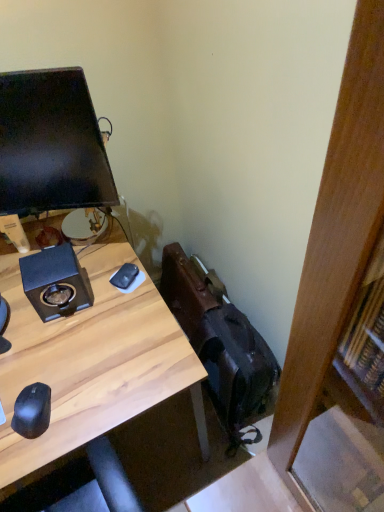
Question: From a real-world perspective, is black matte mouse at center, the 2th mouse positioned from the front, under black matte speaker at upper left?

Choices:
 (A) no
 (B) yes

Answer: (B)

Question: Is black matte mouse at center, the 1th mouse from the right, at the left side of black matte speaker at upper left?

Choices:
 (A) yes
 (B) no

Answer: (B)

Question: From a real-world perspective, is black matte mouse at center, which is counted as the second mouse, starting from the bottom, on top of black matte speaker at upper left?

Choices:
 (A) yes
 (B) no

Answer: (B)

Question: Is the position of black matte mouse at center, the first mouse when ordered from top to bottom, less distant than that of black matte speaker at upper left?

Choices:
 (A) yes
 (B) no

Answer: (B)

Question: Is black matte mouse at center, which is counted as the second mouse, starting from the bottom, smaller than black matte speaker at upper left?

Choices:
 (A) yes
 (B) no

Answer: (A)

Question: From a real-world perspective, is black matte mouse at lower left, which is the 1th mouse in front-to-back order, positioned above or below black matte speaker at upper left?

Choices:
 (A) below
 (B) above

Answer: (A)

Question: Is point (28, 391) positioned closer to the camera than point (79, 289)?

Choices:
 (A) closer
 (B) farther

Answer: (A)

Question: Looking at their shapes, would you say black matte mouse at lower left, arranged as the 2th mouse when viewed from the right, is wider or thinner than black matte speaker at upper left?

Choices:
 (A) wide
 (B) thin

Answer: (B)

Question: From the image's perspective, is black matte mouse at lower left, arranged as the 2th mouse when viewed from the right, located above or below black matte speaker at upper left?

Choices:
 (A) below
 (B) above

Answer: (A)

Question: Considering the positions of black matte speaker at upper left and black matte mouse at lower left, which is the 1th mouse in front-to-back order, in the image, is black matte speaker at upper left bigger or smaller than black matte mouse at lower left, which is the 1th mouse in front-to-back order,?

Choices:
 (A) small
 (B) big

Answer: (B)

Question: Looking at their shapes, would you say black matte speaker at upper left is wider or thinner than black matte mouse at lower left, the second mouse viewed from the top?

Choices:
 (A) wide
 (B) thin

Answer: (A)

Question: Is black matte speaker at upper left in front of or behind black matte mouse at lower left, the second mouse viewed from the top, in the image?

Choices:
 (A) front
 (B) behind

Answer: (B)

Question: Is black matte speaker at upper left inside the boundaries of black matte mouse at lower left, which is the first mouse from bottom to top, or outside?

Choices:
 (A) inside
 (B) outside

Answer: (B)

Question: From a real-world perspective, is black matte speaker at upper left above or below black matte mouse at center, which is counted as the second mouse, starting from the bottom?

Choices:
 (A) below
 (B) above

Answer: (B)

Question: Is black matte speaker at upper left bigger or smaller than black matte mouse at center, the second mouse viewed from the left?

Choices:
 (A) big
 (B) small

Answer: (A)